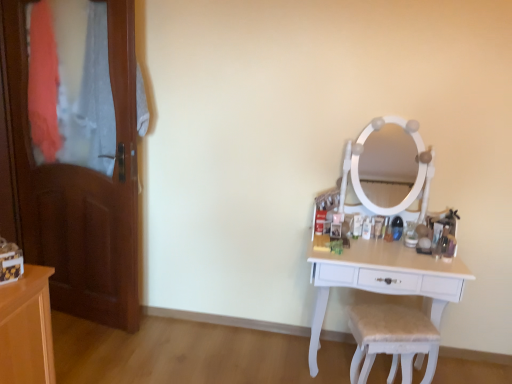
Question: Is white wood table at right located within wooden door at left?

Choices:
 (A) no
 (B) yes

Answer: (A)

Question: Can you confirm if wooden door at left is thinner than white wood table at right?

Choices:
 (A) yes
 (B) no

Answer: (A)

Question: From a real-world perspective, does wooden door at left stand above white wood table at right?

Choices:
 (A) yes
 (B) no

Answer: (A)

Question: Does wooden door at left have a greater height compared to white wood table at right?

Choices:
 (A) yes
 (B) no

Answer: (A)

Question: Does wooden door at left appear on the left side of white wood table at right?

Choices:
 (A) yes
 (B) no

Answer: (A)

Question: Looking at the image, does white wood table at right seem bigger or smaller compared to white fabric-covered chair at lower right?

Choices:
 (A) big
 (B) small

Answer: (A)

Question: Considering the positions of white wood table at right and white fabric-covered chair at lower right in the image, is white wood table at right wider or thinner than white fabric-covered chair at lower right?

Choices:
 (A) thin
 (B) wide

Answer: (B)

Question: Relative to white fabric-covered chair at lower right, is white wood table at right in front or behind?

Choices:
 (A) front
 (B) behind

Answer: (B)

Question: Does point (440, 296) appear closer or farther from the camera than point (406, 342)?

Choices:
 (A) closer
 (B) farther

Answer: (B)

Question: Looking at their shapes, would you say white wood table at right is wider or thinner than wooden door at left?

Choices:
 (A) wide
 (B) thin

Answer: (A)

Question: From the image's perspective, is white wood table at right above or below wooden door at left?

Choices:
 (A) below
 (B) above

Answer: (A)

Question: From a real-world perspective, is white wood table at right positioned above or below wooden door at left?

Choices:
 (A) below
 (B) above

Answer: (A)

Question: Choose the correct answer: Is white wood table at right inside wooden door at left or outside it?

Choices:
 (A) inside
 (B) outside

Answer: (B)

Question: From their relative heights in the image, would you say white fabric-covered chair at lower right is taller or shorter than wooden door at left?

Choices:
 (A) tall
 (B) short

Answer: (B)

Question: Considering the positions of white fabric-covered chair at lower right and wooden door at left in the image, is white fabric-covered chair at lower right wider or thinner than wooden door at left?

Choices:
 (A) wide
 (B) thin

Answer: (A)